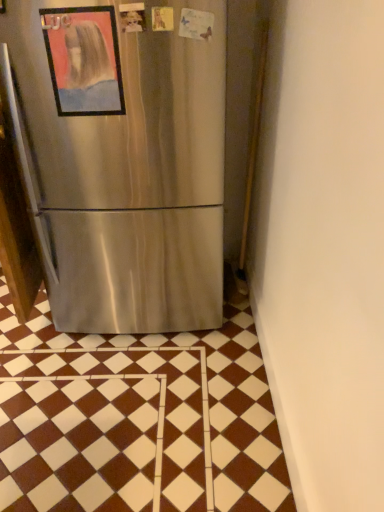
Question: Can you confirm if brown glossy tile at center is positioned to the left of metallic framed painting at upper left?

Choices:
 (A) yes
 (B) no

Answer: (A)

Question: Would you say brown glossy tile at center is outside metallic framed painting at upper left?

Choices:
 (A) no
 (B) yes

Answer: (B)

Question: Could you tell me if brown glossy tile at center is facing metallic framed painting at upper left?

Choices:
 (A) no
 (B) yes

Answer: (A)

Question: Considering the relative sizes of brown glossy tile at center and metallic framed painting at upper left in the image provided, is brown glossy tile at center thinner than metallic framed painting at upper left?

Choices:
 (A) no
 (B) yes

Answer: (A)

Question: Is brown glossy tile at center to the right of metallic framed painting at upper left from the viewer's perspective?

Choices:
 (A) yes
 (B) no

Answer: (B)

Question: Is brown glossy tile at center touching metallic framed painting at upper left?

Choices:
 (A) yes
 (B) no

Answer: (B)

Question: Is metallic framed painting at upper left not within brown glossy tile at center?

Choices:
 (A) yes
 (B) no

Answer: (A)

Question: Is metallic framed painting at upper left at the left side of brown glossy tile at center?

Choices:
 (A) no
 (B) yes

Answer: (A)

Question: Would you say metallic framed painting at upper left is a long distance from brown glossy tile at center?

Choices:
 (A) yes
 (B) no

Answer: (A)

Question: From the image's perspective, is metallic framed painting at upper left above brown glossy tile at center?

Choices:
 (A) no
 (B) yes

Answer: (B)

Question: Would you say metallic framed painting at upper left contains brown glossy tile at center?

Choices:
 (A) yes
 (B) no

Answer: (B)

Question: Can you confirm if metallic framed painting at upper left is bigger than brown glossy tile at center?

Choices:
 (A) no
 (B) yes

Answer: (A)

Question: From the image's perspective, relative to metallic framed painting at upper left, is brown glossy tile at center above or below?

Choices:
 (A) above
 (B) below

Answer: (B)